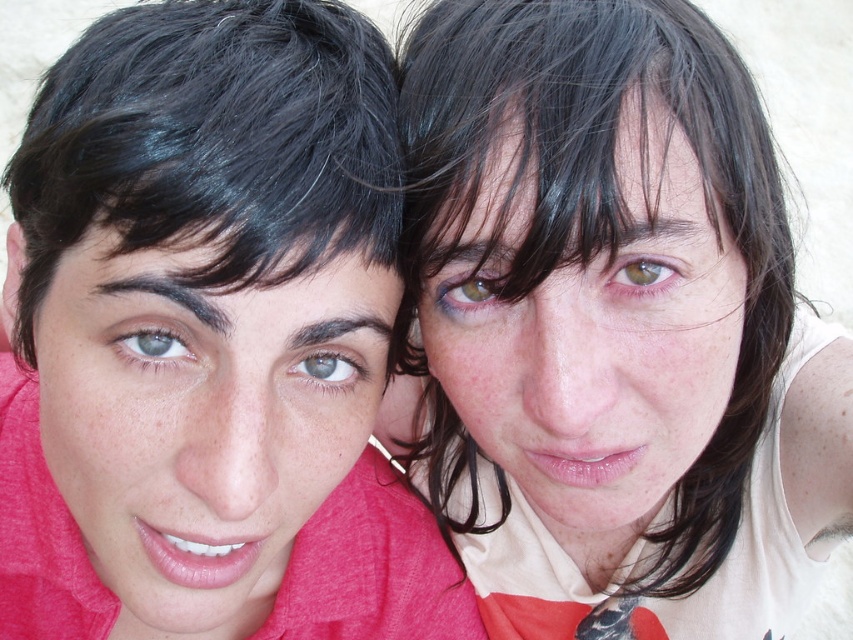
Based on the photo, you are standing at the point marked by the coordinates point [532,433]. You want to know how far you are from the person on the left wearing a bright red garment. Can you determine the distance?

The distance between the point [532,433] and the viewer is 24.04 inches. Since the person on the left is positioned at that point, the distance from the viewer to the person on the left wearing a bright red garment is 24.04 inches.

You are a photographer adjusting the focus of your camera. You want to ensure that both the green matte eye at upper center and the gray matte eye at center are in focus. Based on their positions, which eye should you focus on first to achieve this?

The gray matte eye at center is behind the green matte eye at upper center, so you should focus on the green matte eye at upper center first to ensure both are in focus.